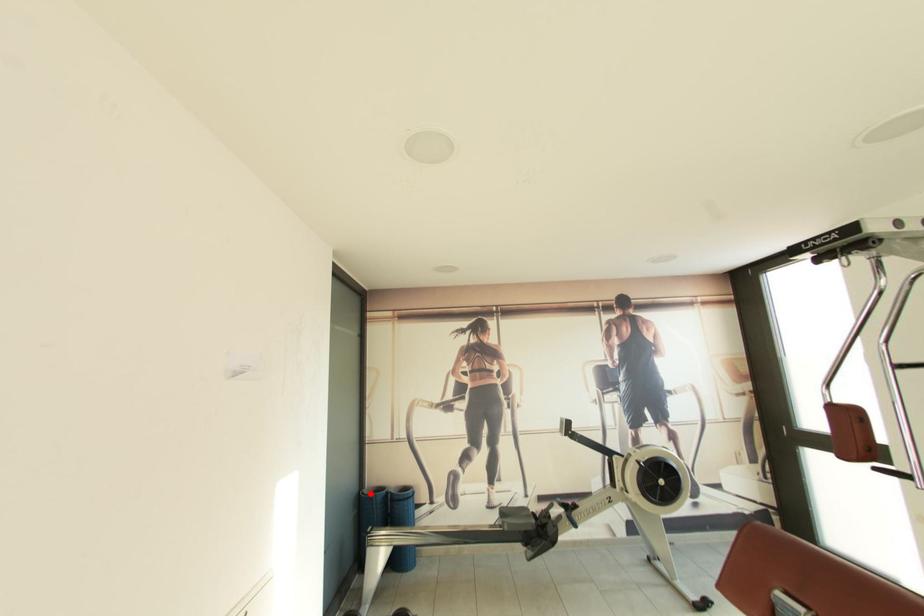
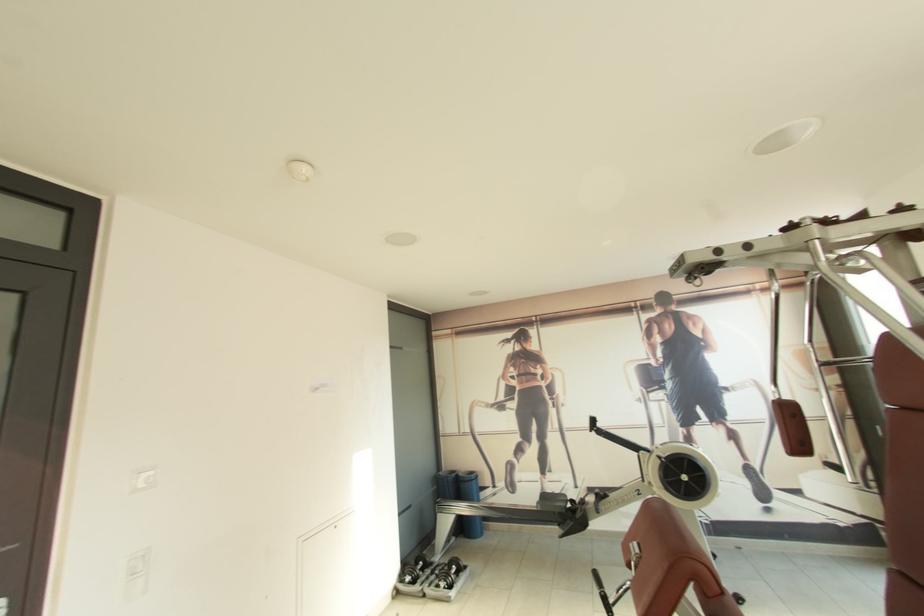
The point at the highlighted location is marked in the first image. Where is the corresponding point in the second image?

(445, 475)